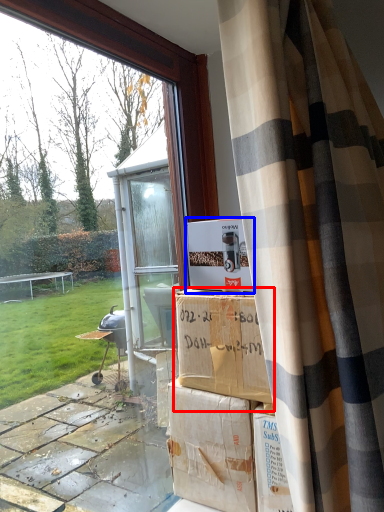
Question: Which of the following is the closest to the observer, cardboard box (highlighted by a red box) or cardboard box (highlighted by a blue box)?

Choices:
 (A) cardboard box
 (B) cardboard box

Answer: (A)